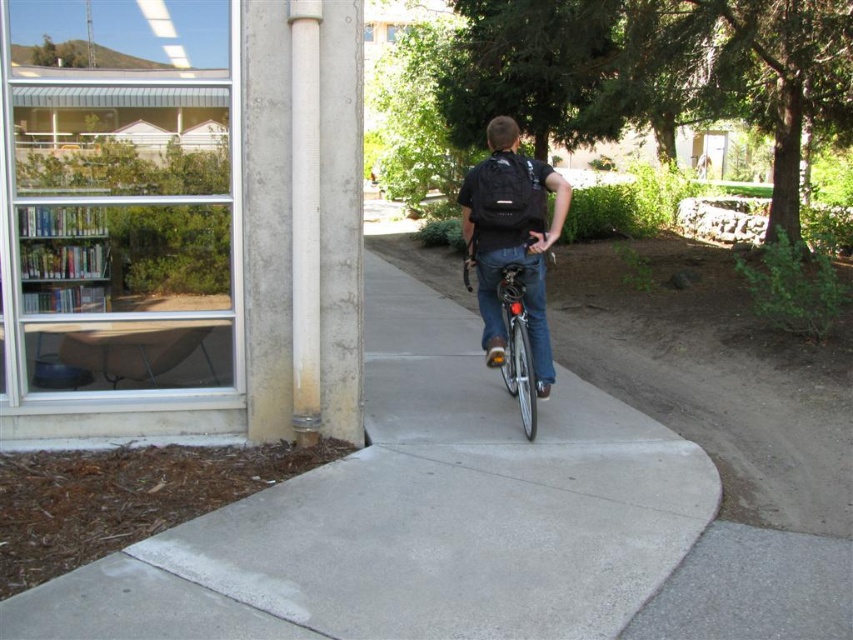
Question: Which object is the farthest from the shiny metallic bicycle at center?

Choices:
 (A) white smooth pipe at center
 (B) black matte backpack at center
 (C) metallic silver bookshelf at upper left

Answer: (C)

Question: Does black matte backpack at center appear on the left side of white smooth pipe at center?

Choices:
 (A) no
 (B) yes

Answer: (A)

Question: Estimate the real-world distances between objects in this image. Which object is closer to the metallic silver bookshelf at upper left?

Choices:
 (A) white smooth pipe at center
 (B) black matte backpack at center

Answer: (A)

Question: Estimate the real-world distances between objects in this image. Which object is closer to the black matte backpack at center?

Choices:
 (A) metallic silver bookshelf at upper left
 (B) shiny metallic bicycle at center
 (C) white smooth pipe at center

Answer: (B)

Question: Is black matte backpack at center smaller than metallic silver bookshelf at upper left?

Choices:
 (A) yes
 (B) no

Answer: (B)

Question: Can you confirm if white smooth pipe at center is bigger than metallic silver bookshelf at upper left?

Choices:
 (A) no
 (B) yes

Answer: (B)